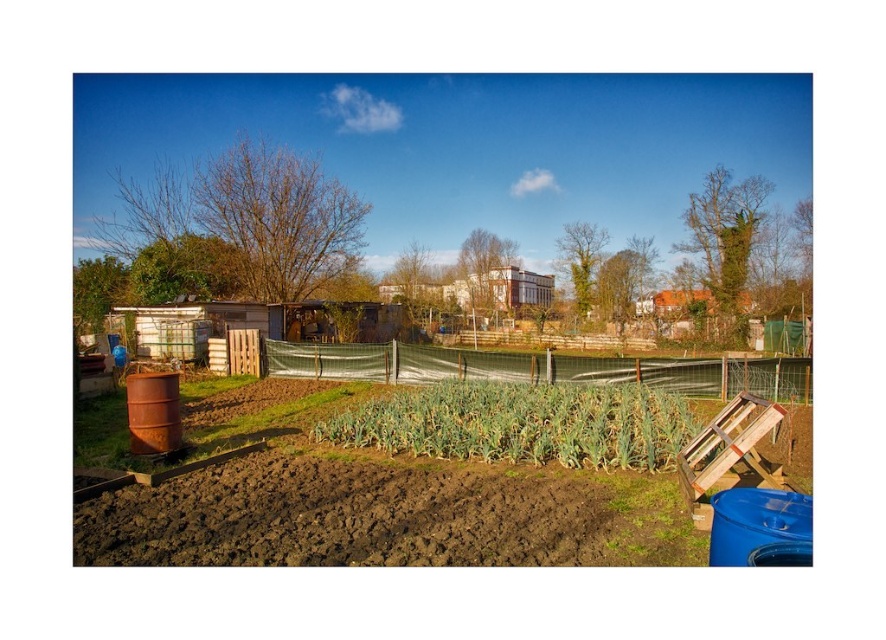
Can you confirm if green leafy plant at center is shorter than green mesh fence at center?

Yes.

Locate an element on the screen. green leafy plant at center is located at coordinates [519, 422].

What are the coordinates of `brown soil at center` in the screenshot? It's located at (382, 508).

At what (x,y) coordinates should I click in order to perform the action: click on brown soil at center. Please return your answer as a coordinate pair (x, y). The image size is (886, 640). Looking at the image, I should click on (382, 508).

Does brown soil at center have a lesser height compared to green leafy plant at center?

Incorrect, brown soil at center's height does not fall short of green leafy plant at center's.

Is brown soil at center smaller than green leafy plant at center?

Incorrect, brown soil at center is not smaller in size than green leafy plant at center.

This screenshot has width=886, height=640. Identify the location of brown soil at center. (382, 508).